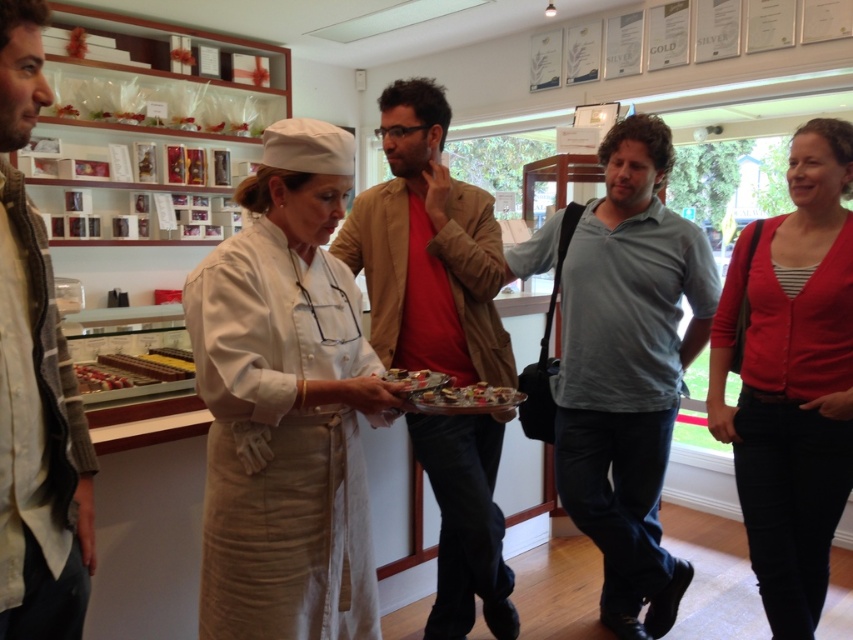
Is point (669, 433) positioned behind point (496, 316)?

Yes, point (669, 433) is behind point (496, 316).

Does point (666, 605) come farther from viewer compared to point (467, 621)?

Yes.

This screenshot has width=853, height=640. What are the coordinates of `gray cotton polo shirt at center` in the screenshot? It's located at (628, 371).

Can you confirm if gray cotton polo shirt at center is positioned to the right of light brown jacket at left?

Indeed, gray cotton polo shirt at center is positioned on the right side of light brown jacket at left.

Does point (583, 380) lie in front of point (12, 285)?

No, it is not.

At what (x,y) coordinates should I click in order to perform the action: click on gray cotton polo shirt at center. Please return your answer as a coordinate pair (x, y). This screenshot has width=853, height=640. Looking at the image, I should click on pos(628,371).

Can you confirm if white linen chef hat at center is positioned to the left of red cardigan at right?

Correct, you'll find white linen chef hat at center to the left of red cardigan at right.

Can you confirm if white linen chef hat at center is wider than red cardigan at right?

Correct, the width of white linen chef hat at center exceeds that of red cardigan at right.

Is point (341, 356) more distant than point (827, 376)?

No, it is not.

Locate an element on the screen. The height and width of the screenshot is (640, 853). white linen chef hat at center is located at coordinates (286, 404).